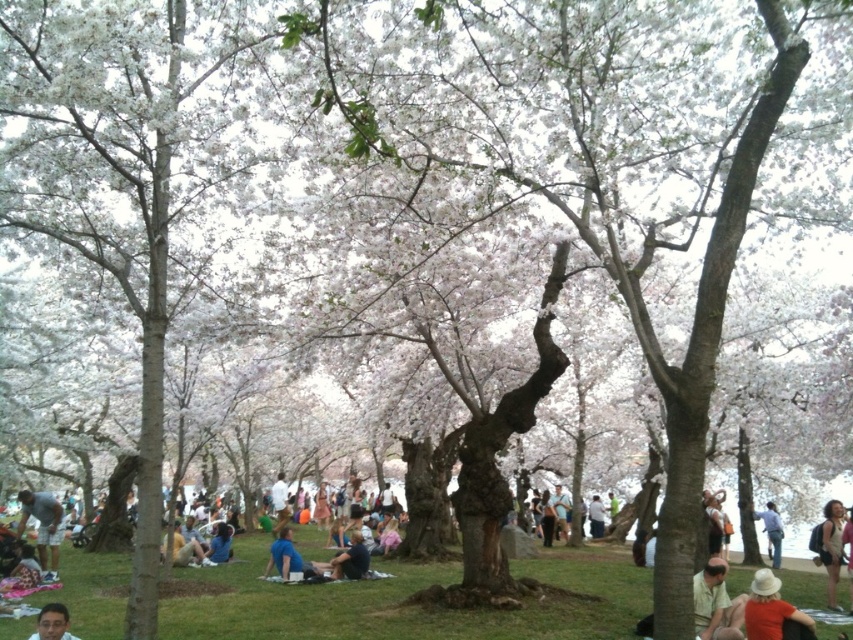
Question: Which point appears closest to the camera in this image?

Choices:
 (A) (836, 604)
 (B) (579, 608)
 (C) (775, 566)

Answer: (B)

Question: Can you confirm if green grass at center is smaller than matte black glasses at lower left?

Choices:
 (A) no
 (B) yes

Answer: (A)

Question: Does green grass at center come in front of dark blue fabric at center?

Choices:
 (A) no
 (B) yes

Answer: (B)

Question: Is dark blue fabric at center wider than blue jeans at lower right?

Choices:
 (A) yes
 (B) no

Answer: (B)

Question: Which object is positioned closest to the matte black glasses at lower left?

Choices:
 (A) dark blue fabric at center
 (B) blue fabric at center
 (C) light blue denim shorts at lower left

Answer: (A)

Question: Which point appears farthest from the camera in this image?

Choices:
 (A) (614, 557)
 (B) (67, 632)
 (C) (730, 632)

Answer: (A)